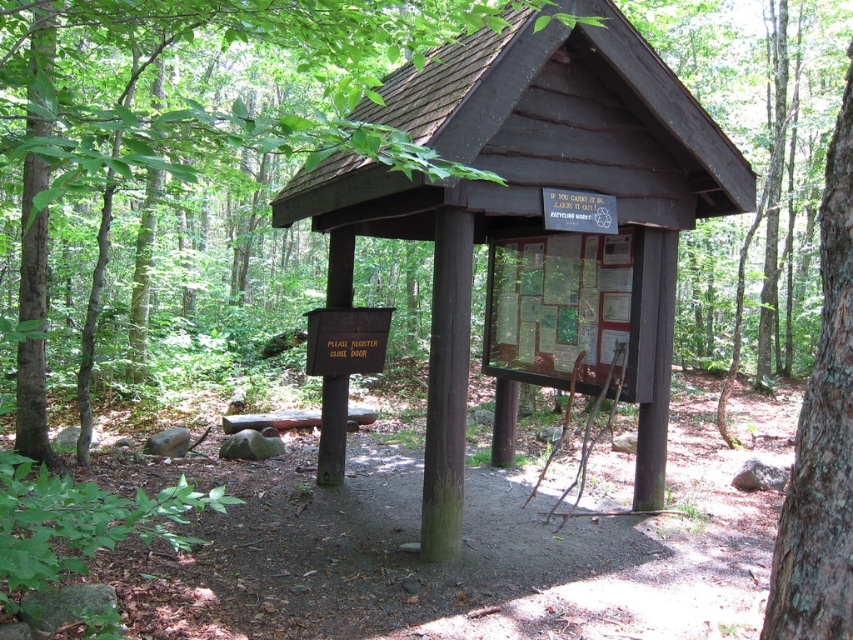
Question: Does brown wood sign at center appear over brown rough bark tree at right?

Choices:
 (A) yes
 (B) no

Answer: (A)

Question: Which point appears farthest from the camera in this image?

Choices:
 (A) (824, 312)
 (B) (9, 115)
 (C) (625, 148)

Answer: (B)

Question: Which object appears closest to the camera in this image?

Choices:
 (A) brown rough bark tree at right
 (B) brown wood sign at center
 (C) dark brown wood sign at center

Answer: (A)

Question: Does brown wood sign at center come behind brown rough bark tree at right?

Choices:
 (A) no
 (B) yes

Answer: (B)

Question: Does brown wood sign at center have a larger size compared to brown rough bark tree at right?

Choices:
 (A) no
 (B) yes

Answer: (A)

Question: Which object appears closest to the camera in this image?

Choices:
 (A) brown wood sign at center
 (B) brown rough bark tree at right
 (C) dark brown wood sign at center

Answer: (B)